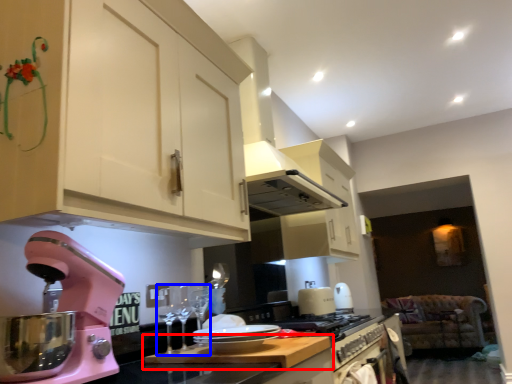
Question: Which of the following is the farthest to the observer, countertop (highlighted by a red box) or wine glass (highlighted by a blue box)?

Choices:
 (A) countertop
 (B) wine glass

Answer: (B)